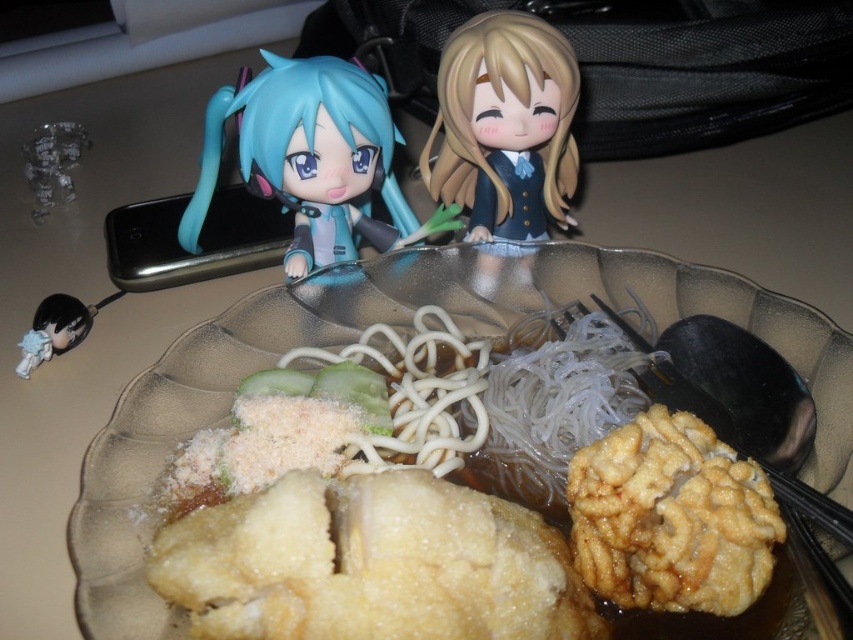
You are a food delivery person who needs to place a golden crispy fried chicken at center and a green salad bowl at upper left into a delivery box. The box can only fit items that are 14 inches apart. Can you fit both items into the box?

The golden crispy fried chicken at center and the green salad bowl at upper left are 13.98 inches apart, which is less than the box capacity of 14 inches. Therefore, both items can fit into the box.

You are a food delivery person who needs to place a small label on the plate. The label must be placed exactly between the blonde hair doll at upper center and the white glossy noodles at center. How far apart are these two items?

The blonde hair doll at upper center and the white glossy noodles at center are 6.22 inches apart from each other.

You are holding a 12 inch ruler and want to measure the distance between the point at coordinates point (x=113, y=470) and yourself. Can your ruler reach that distance?

The distance between point (x=113, y=470) and the viewer is 17.12 inches. Since the ruler is only 12 inches long, it cannot reach the full distance.